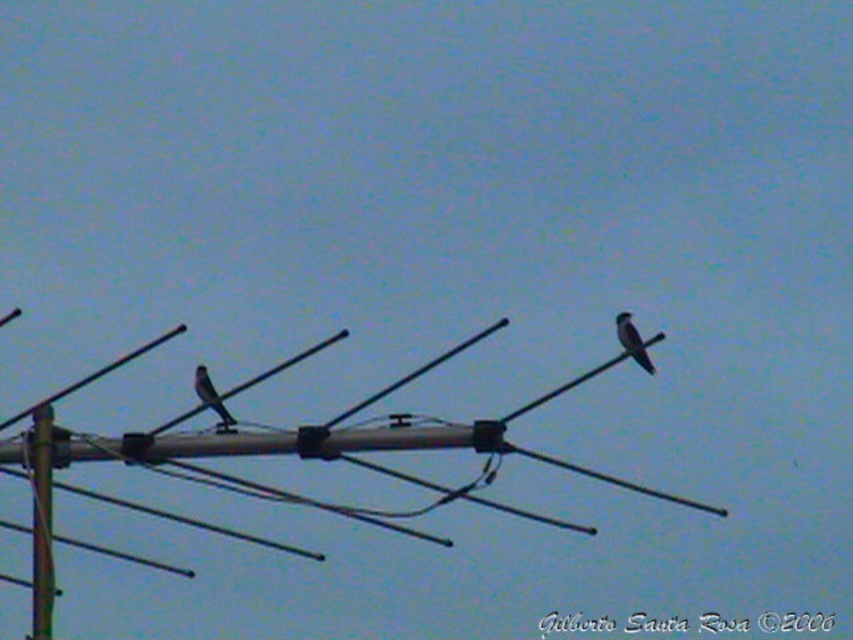
Question: Does dark gray feathers at upper right appear under gray matte bird at left?

Choices:
 (A) yes
 (B) no

Answer: (B)

Question: Which of the following is the farthest from the observer?

Choices:
 (A) gray matte bird at left
 (B) dark gray feathers at upper right

Answer: (A)

Question: Can you confirm if dark gray feathers at upper right is positioned to the left of gray matte bird at left?

Choices:
 (A) yes
 (B) no

Answer: (B)

Question: Which point is farther to the camera?

Choices:
 (A) (643, 356)
 (B) (196, 374)

Answer: (B)

Question: Is dark gray feathers at upper right behind gray matte bird at left?

Choices:
 (A) no
 (B) yes

Answer: (A)